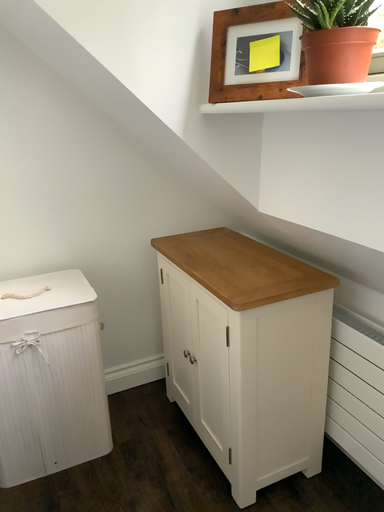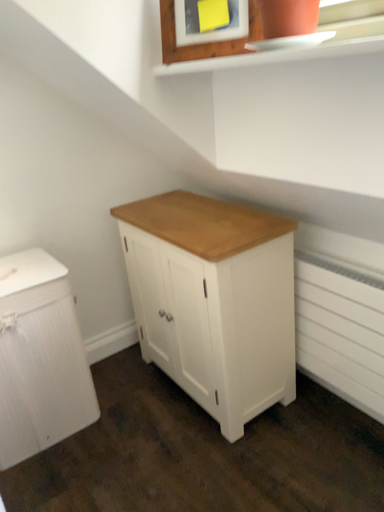
Question: Which way did the camera rotate in the video?

Choices:
 (A) rotated left
 (B) rotated right

Answer: (B)